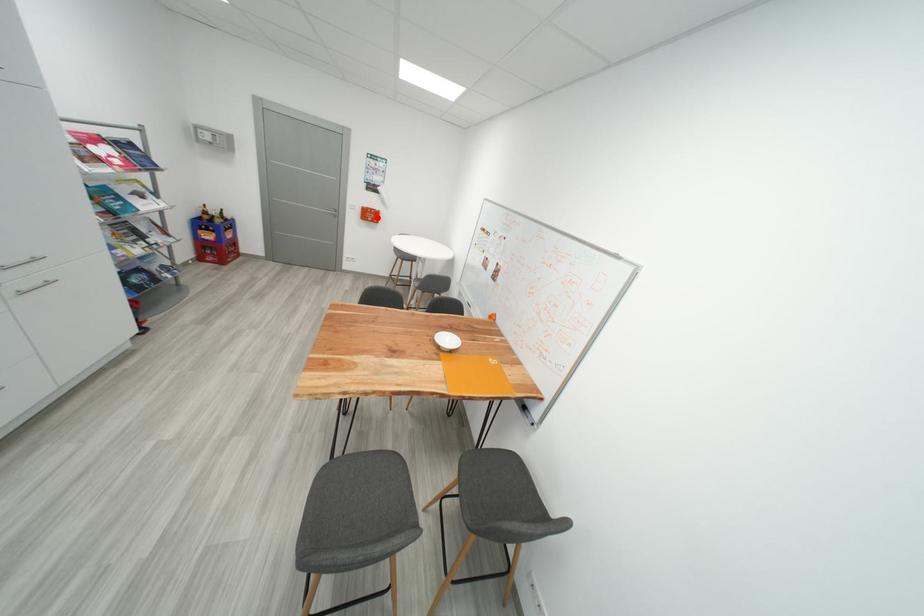
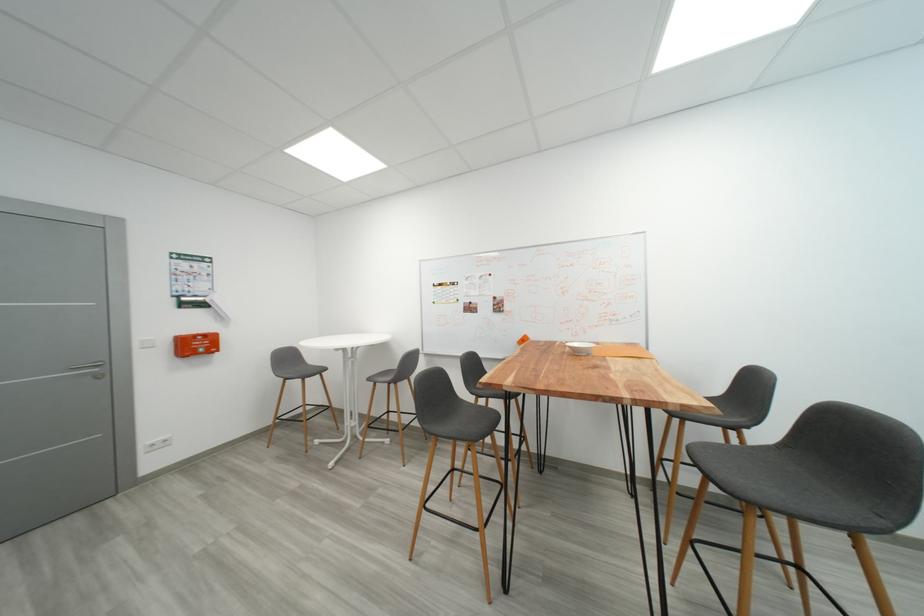
Find the pixel in the second image that matches the highlighted location in the first image.

(203, 347)